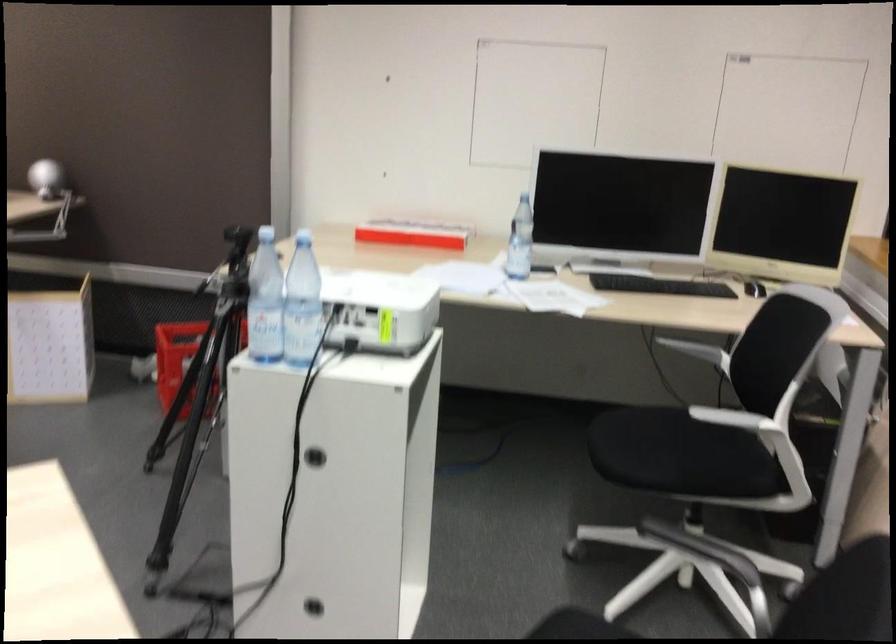
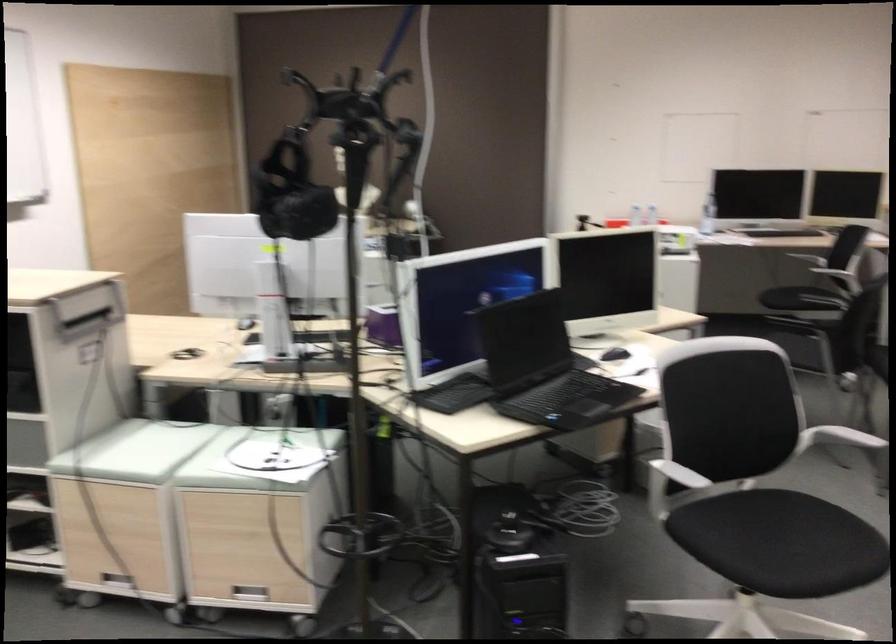
Question: I am providing you with two images of the same scene from different viewpoints. After the viewpoint changes to image2, which objects are now occluded?

Choices:
 (A) chair sitting surface
 (B) black VR headset
 (C) white chair armrest
 (D) black container lid

Answer: (A)